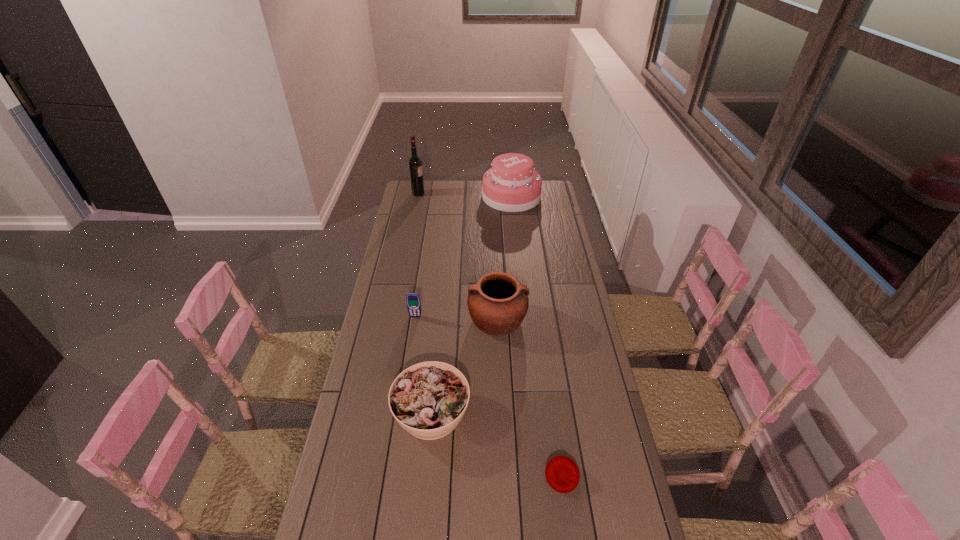
In order to click on empty space between the pottery and the cake in this screenshot , I will do `click(504, 258)`.

Identify the location of vacant space that is in between the cake and the nearest object. (537, 336).

What are the coordinates of `vacant space in between the third tallest object and the cellular telephone` in the screenshot? It's located at (456, 318).

Identify the location of blank region between the cake and the pottery. Image resolution: width=960 pixels, height=540 pixels. (504, 258).

The height and width of the screenshot is (540, 960). In order to click on free space between the fifth shortest object and the tallest object in this screenshot , I will do `click(465, 195)`.

Point out which object is positioned as the third nearest to the fifth shortest object. Please provide its 2D coordinates. Your answer should be formatted as a tuple, i.e. [(x, y)], where the tuple contains the x and y coordinates of a point satisfying the conditions above.

[(413, 302)]

Where is `object that is the fourth closest to the cellular telephone`? The width and height of the screenshot is (960, 540). object that is the fourth closest to the cellular telephone is located at coordinates (512, 185).

Where is `free space in the image that satisfies the following two spatial constraints: 1. on the front and back of the wine bottle; 2. on the right side of the cake`? The height and width of the screenshot is (540, 960). free space in the image that satisfies the following two spatial constraints: 1. on the front and back of the wine bottle; 2. on the right side of the cake is located at coordinates (418, 197).

This screenshot has height=540, width=960. Find the location of `vacant space that satisfies the following two spatial constraints: 1. on the front and back of the cake; 2. on the left side of the wine bottle`. vacant space that satisfies the following two spatial constraints: 1. on the front and back of the cake; 2. on the left side of the wine bottle is located at coordinates (418, 197).

I want to click on vacant space that satisfies the following two spatial constraints: 1. on the front and back of the tallest object; 2. on the back side of the fifth farthest object, so click(x=373, y=413).